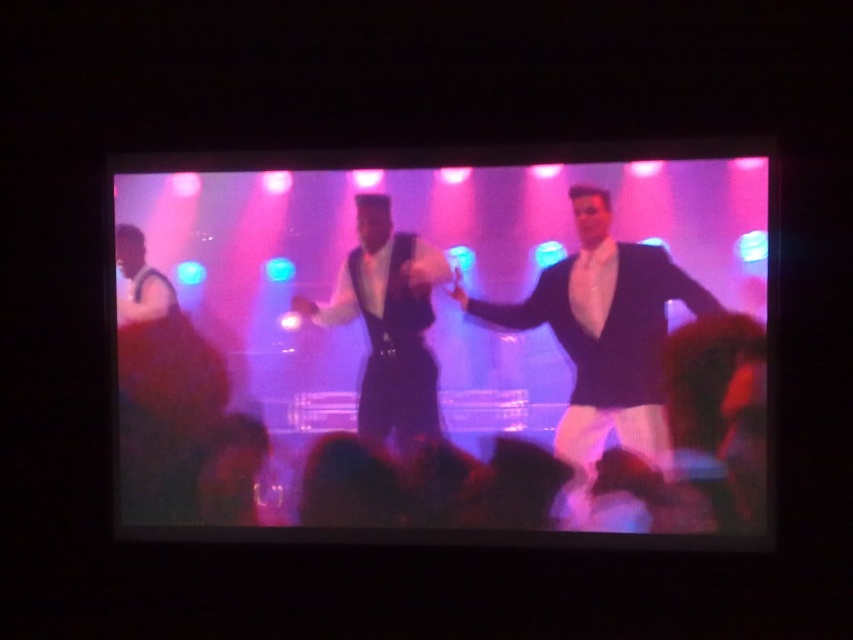
Question: Among these objects, which one is farthest from the camera?

Choices:
 (A) shiny black suit at center
 (B) shiny black vest at center
 (C) matte black suit at center
 (D) matte white vest at left

Answer: (D)

Question: Is matte black suit at center thinner than shiny black vest at center?

Choices:
 (A) yes
 (B) no

Answer: (B)

Question: Is the position of matte black suit at center less distant than that of matte white vest at left?

Choices:
 (A) no
 (B) yes

Answer: (B)

Question: Can you confirm if shiny black suit at center is bigger than matte white vest at left?

Choices:
 (A) yes
 (B) no

Answer: (A)

Question: Which point is closer to the camera?

Choices:
 (A) pos(372,241)
 (B) pos(579,225)

Answer: (B)

Question: Among these points, which one is nearest to the camera?

Choices:
 (A) (550, 326)
 (B) (390, 189)

Answer: (A)